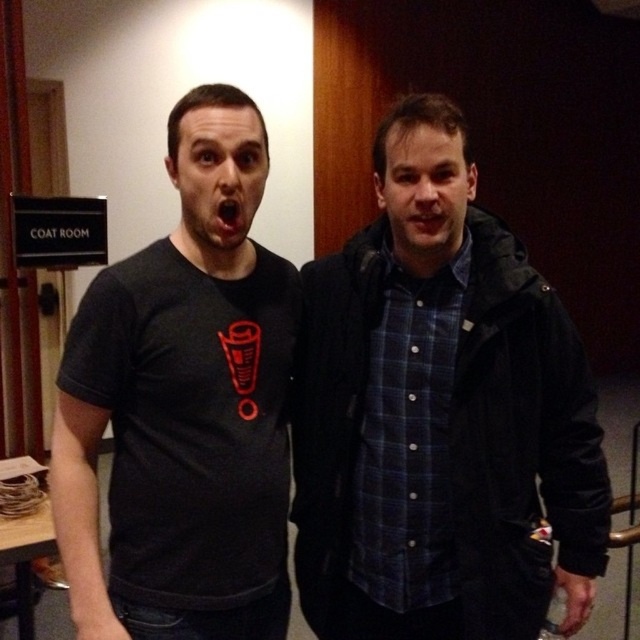
Between black matte jacket at center and black matte mouth at center, which one is positioned lower?

black matte jacket at center is lower down.

Can you confirm if black matte jacket at center is positioned to the left of black matte mouth at center?

No, black matte jacket at center is not to the left of black matte mouth at center.

You are a GUI agent. You are given a task and a screenshot of the screen. Output one action in this format:
    pyautogui.click(x=<x>, y=<y>)
    Task: Click on the black matte jacket at center
    
    Given the screenshot: What is the action you would take?
    pyautogui.click(x=440, y=416)

Who is positioned more to the left, black matte jacket at center or black matte t-shirt at left?

black matte t-shirt at left is more to the left.

Is black matte jacket at center positioned in front of black matte t-shirt at left?

No, black matte jacket at center is further to the viewer.

Which is behind, point (376, 493) or point (252, 250)?

The point (252, 250) is behind.

At what (x,y) coordinates should I click in order to perform the action: click on black matte jacket at center. Please return your answer as a coordinate pair (x, y). This screenshot has height=640, width=640. Looking at the image, I should click on click(x=440, y=416).

Does black matte t-shirt at left have a lesser width compared to black matte mouth at center?

No.

From the picture: Measure the distance between black matte t-shirt at left and black matte mouth at center.

The distance of black matte t-shirt at left from black matte mouth at center is 32.29 centimeters.

Which is behind, point (120, 452) or point (234, 212)?

The point (120, 452) is more distant.

You are a GUI agent. You are given a task and a screenshot of the screen. Output one action in this format:
    pyautogui.click(x=<x>, y=<y>)
    Task: Click on the black matte t-shirt at left
    
    Given the screenshot: What is the action you would take?
    pyautogui.click(x=182, y=406)